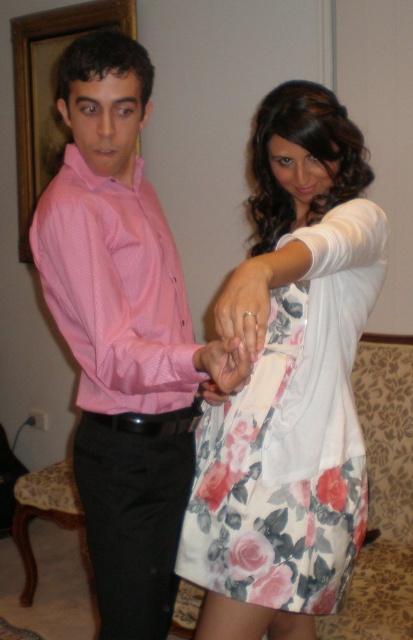
Question: Which is farther from the pink shirt at left?

Choices:
 (A) black leather belt at lower center
 (B) pink textured shirt at left
 (C) floral cotton dress at center
 (D) matte white ring at center

Answer: (D)

Question: Which point is farther from the camera taking this photo?

Choices:
 (A) (213, 353)
 (B) (83, 413)
 (C) (21, 96)
 (D) (234, 432)

Answer: (C)

Question: Is pink matte hand at center to the left of black leather belt at lower center from the viewer's perspective?

Choices:
 (A) yes
 (B) no

Answer: (B)

Question: Among these objects, which one is farthest from the camera?

Choices:
 (A) floral cotton dress at center
 (B) black leather belt at lower center
 (C) pink textured shirt at left
 (D) pink smooth shirt at center

Answer: (B)

Question: Is pink smooth shirt at center thinner than floral cotton dress at center?

Choices:
 (A) yes
 (B) no

Answer: (A)

Question: Does floral cotton dress at center lie behind pink matte hand at center?

Choices:
 (A) yes
 (B) no

Answer: (A)